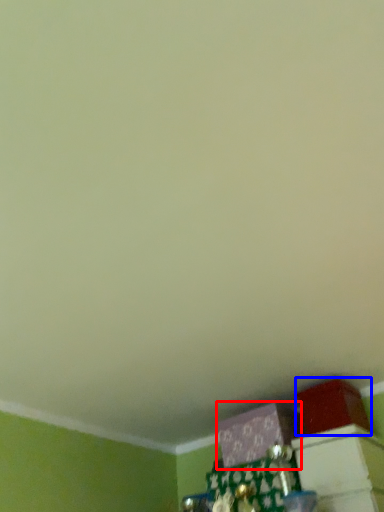
Question: Which object is closer to the camera taking this photo, box (highlighted by a red box) or box (highlighted by a blue box)?

Choices:
 (A) box
 (B) box

Answer: (B)